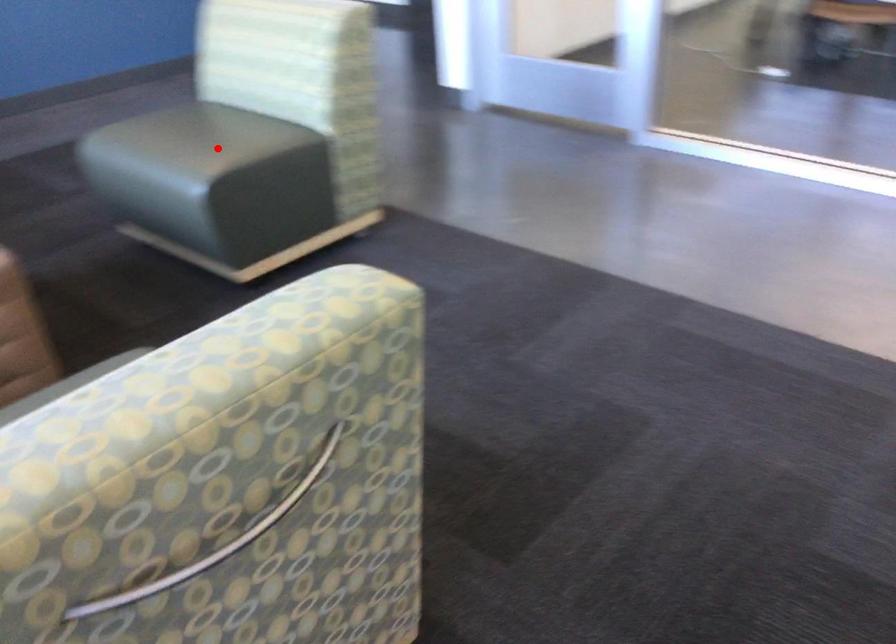
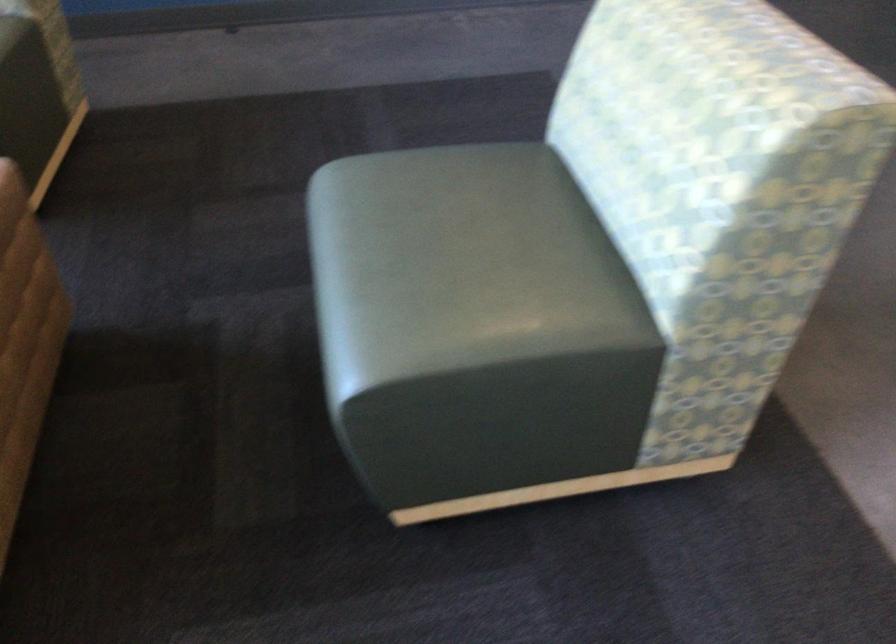
The point at the highlighted location is marked in the first image. Where is the corresponding point in the second image?

(460, 265)